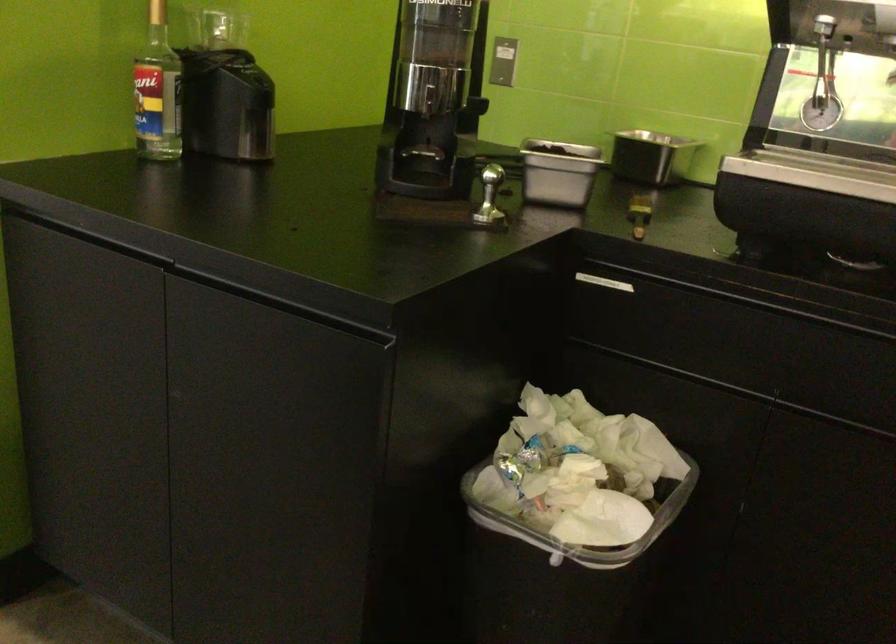
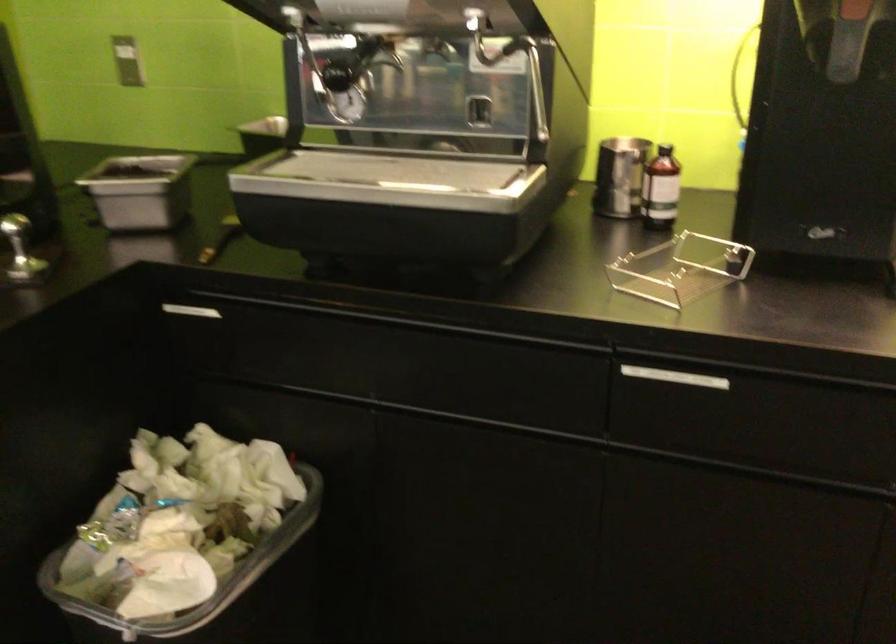
Locate, in the second image, the point that corresponds to (x=638, y=542) in the first image.

(218, 592)